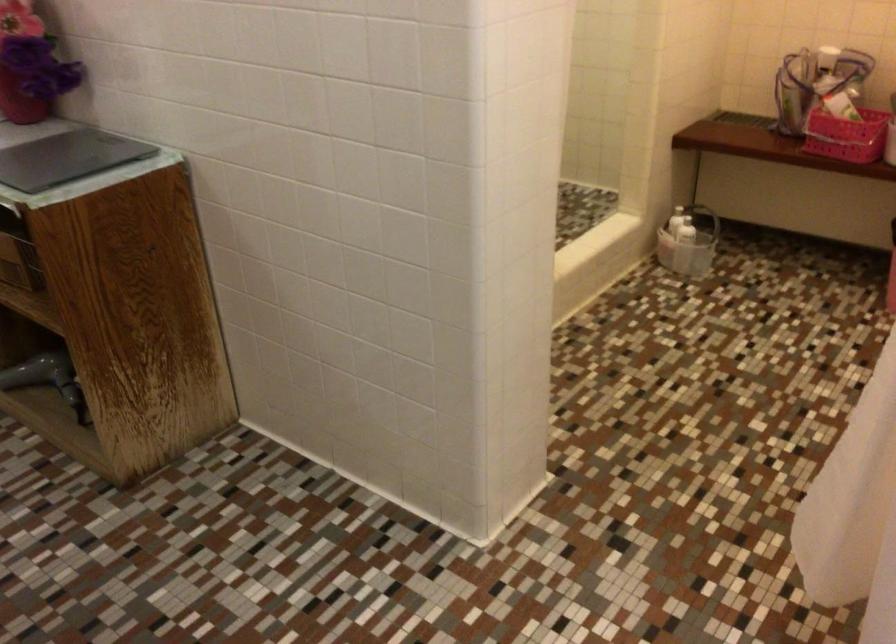
Find where to lift the gray hair dryer. Please return your answer as a coordinate pair (x, y).

(47, 379)